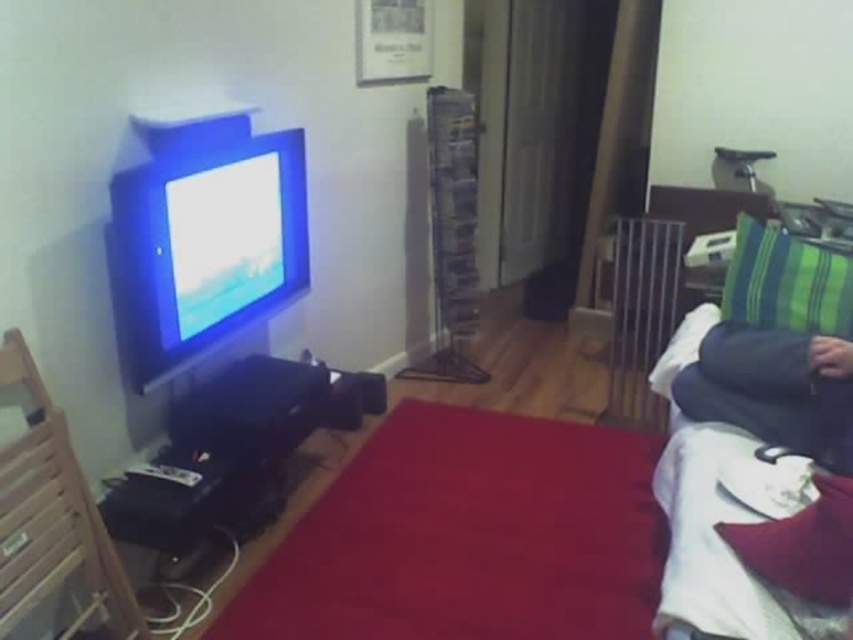
You are a delivery person who needs to place a large package on the floor between the dark blue fabric at right and the velvet red pillow at lower right. Can you fit the package there if it is 1 meter wide?

The dark blue fabric at right might be wider than the velvet red pillow at lower right, so the space between them could be more than 1 meter. However, since the exact width isn not specified, it is uncertain if the package will fit.

You are sitting on a couch in the living room and want to pick up both the green striped pillow at right and the velvet red pillow at lower right. Which pillow should you reach for first if you want to grab the one that is higher up?

The green striped pillow at right is above the velvet red pillow at lower right, so you should reach for the green striped pillow at right first since it is higher up.

You are sitting on the couch in the living room and want to place a book on the dark blue fabric at right and the green striped pillow at right. Which object is closer to the wall?

The dark blue fabric at right is closer to the wall because it is to the left of the green striped pillow at right, and since the wall is on the right side of the image, the left side of the objects would be nearer to the wall.